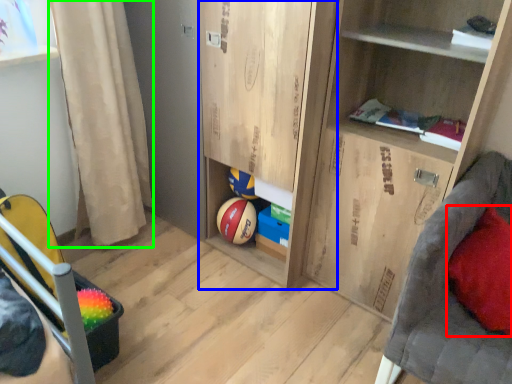
Question: Which object is positioned farthest from pillow (highlighted by a red box)? Select from cabinet (highlighted by a blue box) and curtain (highlighted by a green box).

Choices:
 (A) cabinet
 (B) curtain

Answer: (B)